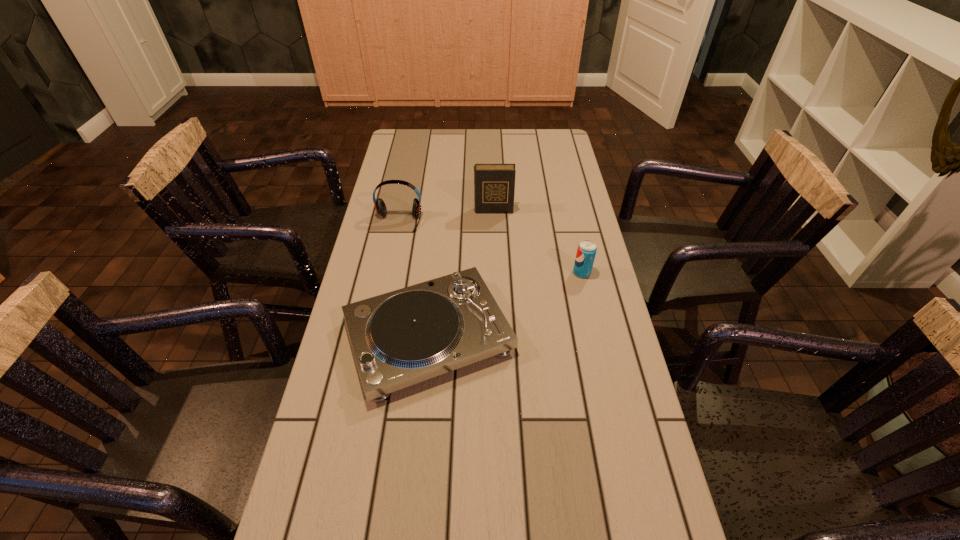
The width and height of the screenshot is (960, 540). I want to click on headset positioned at the left edge, so click(x=380, y=206).

Find the location of a particular element. The height and width of the screenshot is (540, 960). record player at the left edge is located at coordinates (400, 338).

Locate an element on the screen. The image size is (960, 540). object that is at the right edge is located at coordinates (586, 251).

What are the coordinates of `free region at the far edge` in the screenshot? It's located at (503, 133).

In the image, there is a desktop. At what (x,y) coordinates should I click in order to perform the action: click on free space at the left edge. Please return your answer as a coordinate pair (x, y). The height and width of the screenshot is (540, 960). Looking at the image, I should click on (387, 198).

Find the location of a particular element. Image resolution: width=960 pixels, height=540 pixels. blank space at the right edge of the desktop is located at coordinates (575, 187).

What are the coordinates of `vacant point located between the third shortest object and the rightmost object` in the screenshot? It's located at (491, 247).

Identify the location of vacant space in between the third shortest object and the diary. (446, 216).

Identify the location of free space between the shortest object and the second shortest object. This screenshot has height=540, width=960. (505, 305).

The image size is (960, 540). In order to click on free space between the tallest object and the headset in this screenshot , I will do `click(446, 216)`.